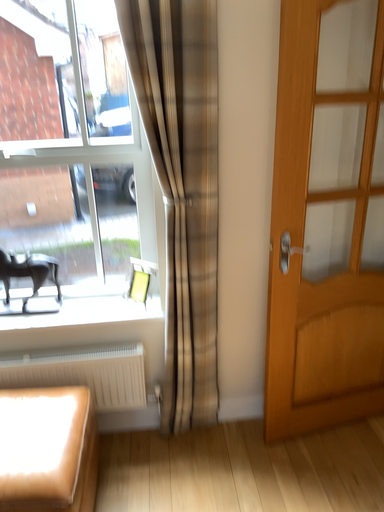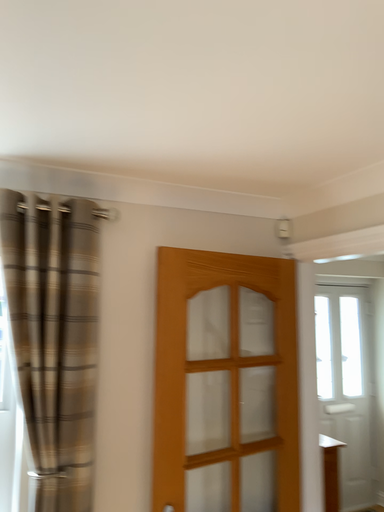
Question: Which way did the camera rotate in the video?

Choices:
 (A) rotated downward
 (B) rotated upward

Answer: (B)